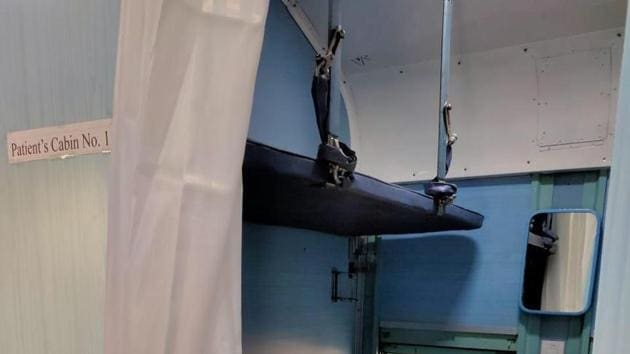
Locate an element on the screen. This screenshot has height=354, width=630. white curtain or divider is located at coordinates (201, 173).